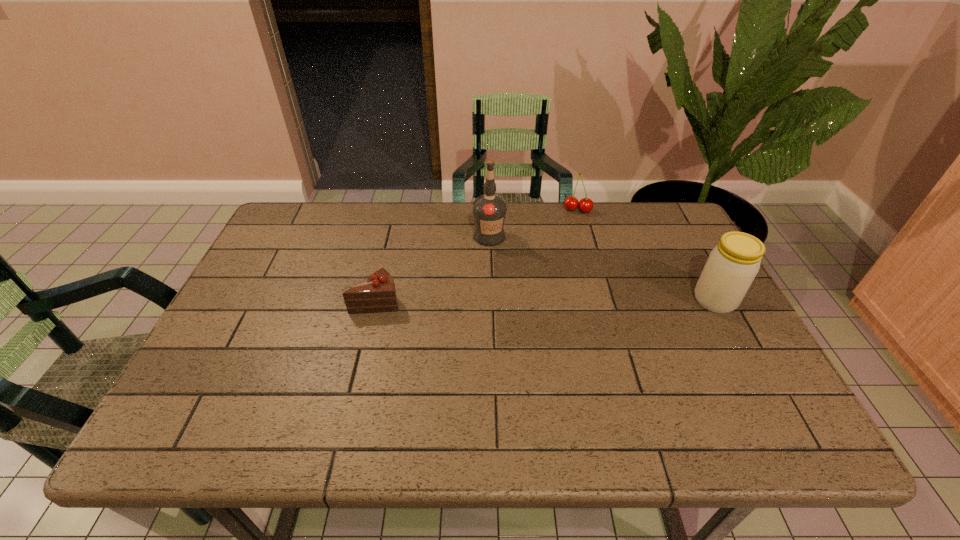
Locate an element on the screen. This screenshot has height=540, width=960. the leftmost object is located at coordinates pyautogui.click(x=377, y=293).

At what (x,y) coordinates should I click in order to perform the action: click on the shortest object. Please return your answer as a coordinate pair (x, y). The width and height of the screenshot is (960, 540). Looking at the image, I should click on (377, 293).

Locate an element on the screen. jar is located at coordinates (732, 265).

Where is `the rightmost object`? This screenshot has height=540, width=960. the rightmost object is located at coordinates (732, 265).

Locate an element on the screen. the second object from right to left is located at coordinates (571, 203).

What are the coordinates of `cherry` in the screenshot? It's located at (571, 203).

The image size is (960, 540). I want to click on vodka, so click(x=489, y=210).

The width and height of the screenshot is (960, 540). I want to click on the second object from left to right, so click(489, 210).

In order to click on vacant space located on the back of the shortest object in this screenshot , I will do `click(394, 227)`.

Locate an element on the screen. The height and width of the screenshot is (540, 960). vacant space located on the back of the rightmost object is located at coordinates (690, 255).